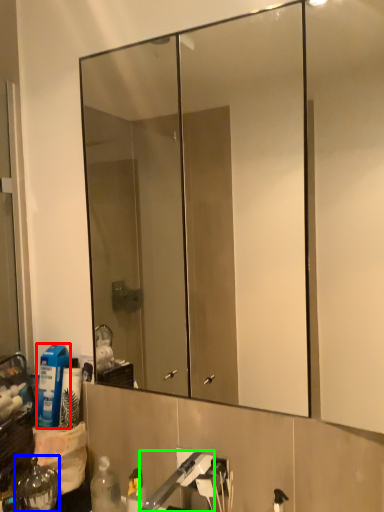
Question: Which is nearer to the cleaning product (highlighted by a red box)? bottle (highlighted by a blue box) or faucet (highlighted by a green box).

Choices:
 (A) bottle
 (B) faucet

Answer: (A)